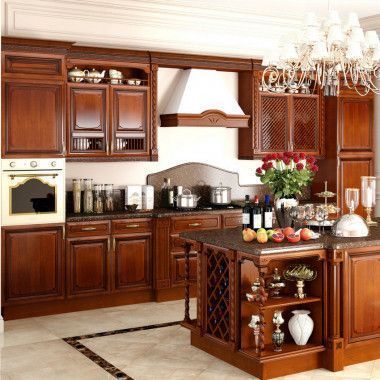
This screenshot has width=380, height=380. In order to click on shelf in this screenshot , I will do `click(284, 306)`.